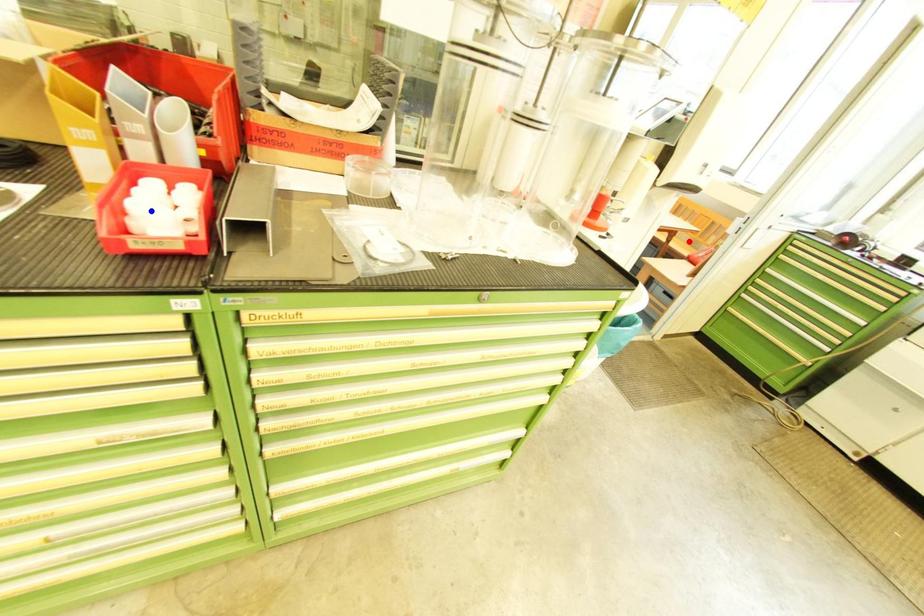
Question: In the image, two points are highlighted. Which point is nearer to the camera? Reply with the corresponding letter.

Choices:
 (A) blue point
 (B) red point

Answer: (A)